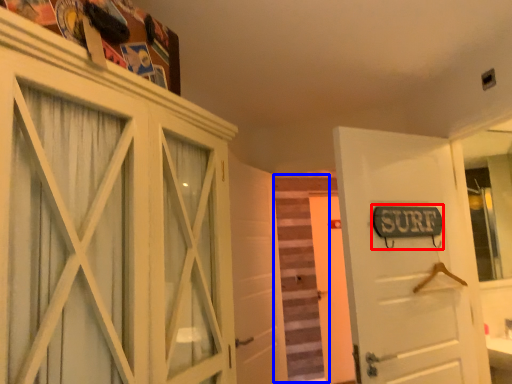
Question: Which object is further to the camera taking this photo, street sign (highlighted by a red box) or stair (highlighted by a blue box)?

Choices:
 (A) street sign
 (B) stair

Answer: (B)